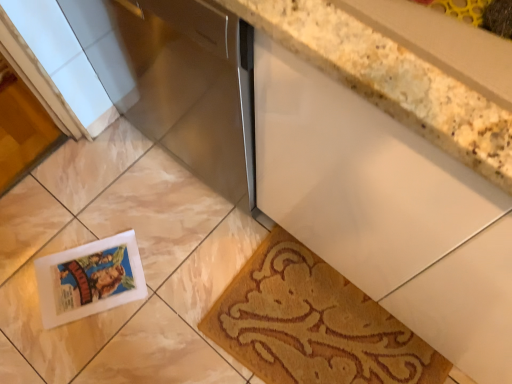
This screenshot has width=512, height=384. Find the location of `vacant region to the left of white glossy postcard at lower left`. vacant region to the left of white glossy postcard at lower left is located at coordinates (23, 264).